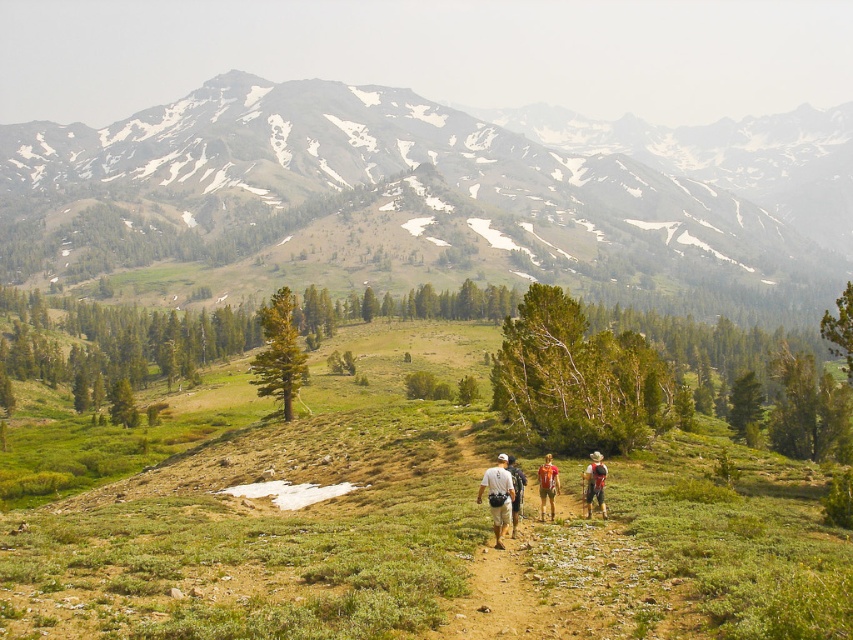
You are a hiker planning to climb the mountain. You see the green grassy mountain at upper center and the camouflage fabric shorts at center. Which object is taller?

The green grassy mountain at upper center is taller than the camouflage fabric shorts at center.

You are a hiker standing at the starting point of the trail. You see the green grassy at center and the green grassy mountain at upper center. Which one is closer to you?

The green grassy at center is closer to the viewer than the green grassy mountain at upper center.